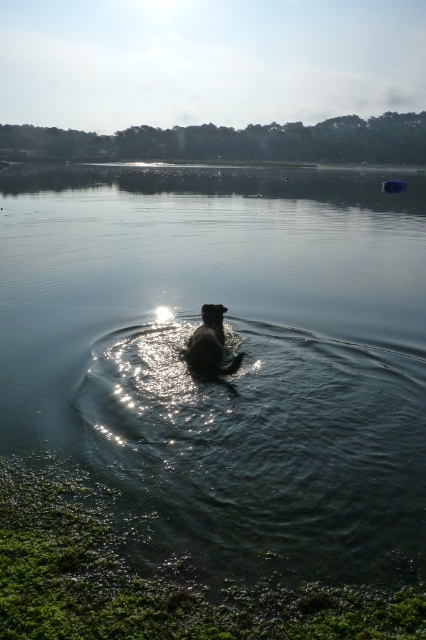
Can you confirm if clear water at center is positioned below shiny brown dog at center?

Actually, clear water at center is above shiny brown dog at center.

Consider the image. How far apart are clear water at center and shiny brown dog at center?

clear water at center is 34.57 feet from shiny brown dog at center.

The height and width of the screenshot is (640, 426). What do you see at coordinates (230, 355) in the screenshot?
I see `clear water at center` at bounding box center [230, 355].

This screenshot has width=426, height=640. I want to click on clear water at center, so [230, 355].